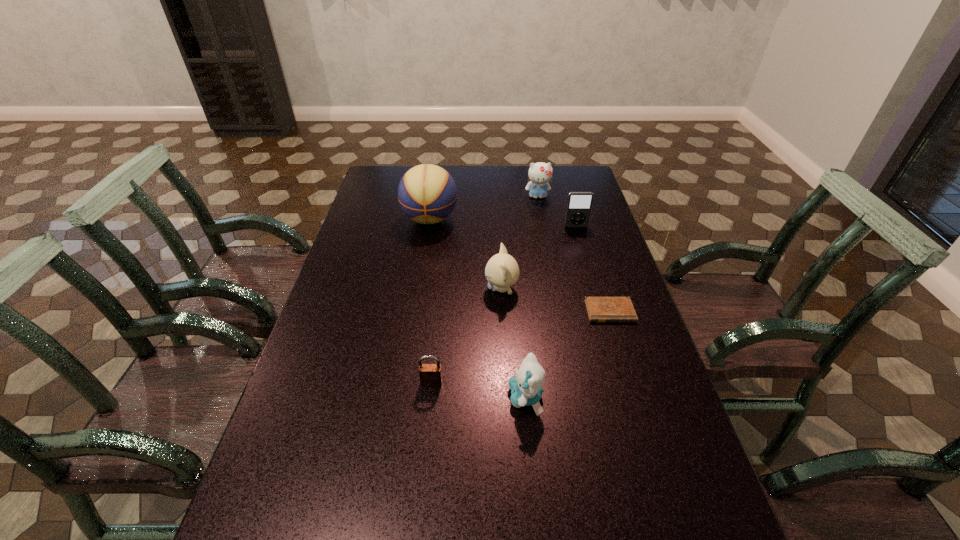
Where is `vacant space that's between the basketball and the second nearest kitten`? The width and height of the screenshot is (960, 540). vacant space that's between the basketball and the second nearest kitten is located at coordinates point(466,254).

Identify the location of free point between the nearest kitten and the fifth object from left to right. Image resolution: width=960 pixels, height=540 pixels. (532, 297).

Identify which object is located as the fourth nearest to the tallest object. Please provide its 2D coordinates. Your answer should be formatted as a tuple, i.e. [(x, y)], where the tuple contains the x and y coordinates of a point satisfying the conditions above.

[(599, 309)]

Where is `object that stands as the third closest to the second nearest kitten`? This screenshot has width=960, height=540. object that stands as the third closest to the second nearest kitten is located at coordinates coord(526,388).

Point out which kitten is positioned as the nearest to the nearest kitten. Please provide its 2D coordinates. Your answer should be formatted as a tuple, i.e. [(x, y)], where the tuple contains the x and y coordinates of a point satisfying the conditions above.

[(502, 271)]

Identify the location of kitten identified as the second closest to the iPod. (502, 271).

Identify the location of vacant area in the image that satisfies the following two spatial constraints: 1. on the front-facing side of the iPod; 2. on the face of the second nearest kitten. The height and width of the screenshot is (540, 960). (593, 289).

You are a GUI agent. You are given a task and a screenshot of the screen. Output one action in this format:
    pyautogui.click(x=<x>, y=<y>)
    Task: Click on the vacant area in the image that satisfies the following two spatial constraints: 1. on the front-facing side of the farthest kitten; 2. on the face of the second nearest kitten
    The height and width of the screenshot is (540, 960).
    Given the screenshot: What is the action you would take?
    click(x=555, y=289)